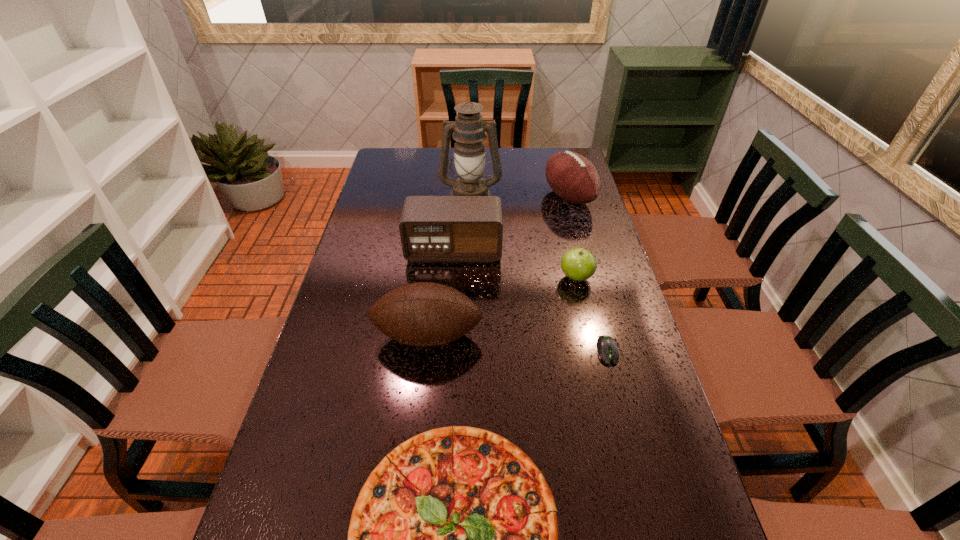
Point out which object is positioned as the sixth nearest to the nearest object. Please provide its 2D coordinates. Your answer should be formatted as a tuple, i.e. [(x, y)], where the tuple contains the x and y coordinates of a point satisfying the conditions above.

[(469, 128)]